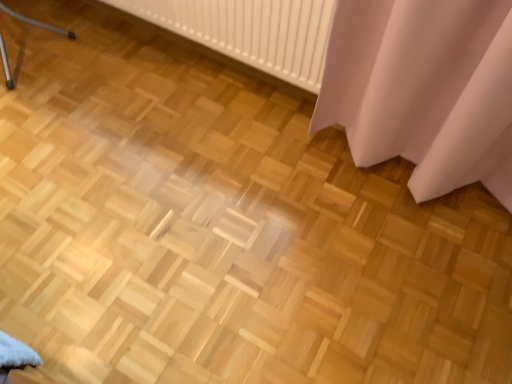
The height and width of the screenshot is (384, 512). What do you see at coordinates (250, 31) in the screenshot?
I see `white textured radiator at upper center` at bounding box center [250, 31].

Find the location of a particular element. white textured radiator at upper center is located at coordinates (250, 31).

The height and width of the screenshot is (384, 512). I want to click on white textured radiator at upper center, so click(x=250, y=31).